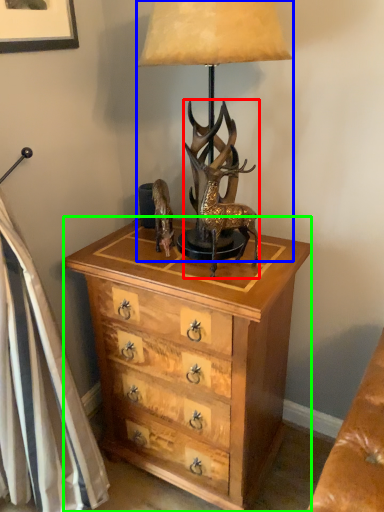
Question: Which object is the farthest from deer (highlighted by a red box)? Choose among these: lamp (highlighted by a blue box) or chest of drawers (highlighted by a green box).

Choices:
 (A) lamp
 (B) chest of drawers

Answer: (B)